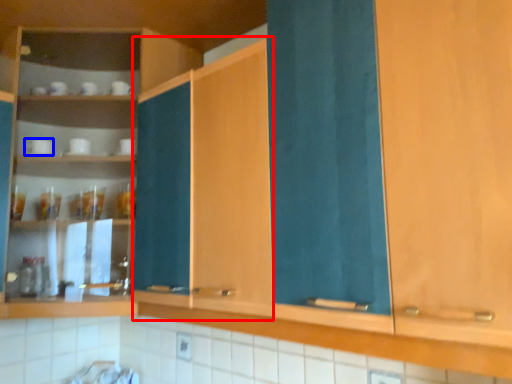
Question: Which point is closer to the camera, cabinetry (highlighted by a red box) or tableware (highlighted by a blue box)?

Choices:
 (A) cabinetry
 (B) tableware

Answer: (A)